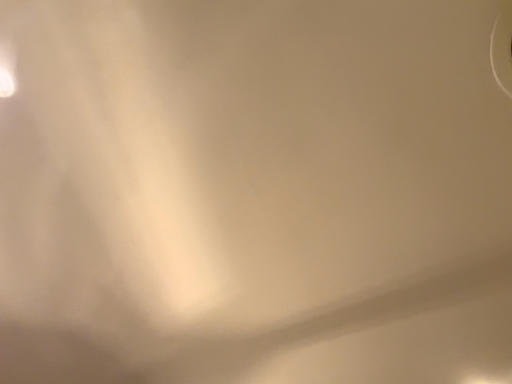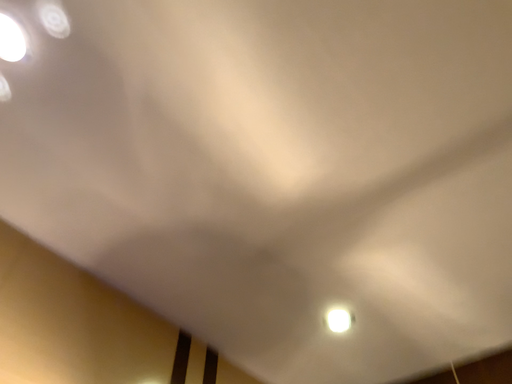
Question: Which way did the camera rotate in the video?

Choices:
 (A) rotated upward
 (B) rotated downward

Answer: (B)